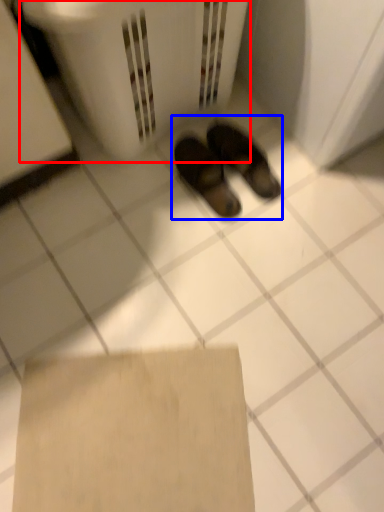
Question: Which of the following is the closest to the observer, laundry basket (highlighted by a red box) or footwear (highlighted by a blue box)?

Choices:
 (A) laundry basket
 (B) footwear

Answer: (A)